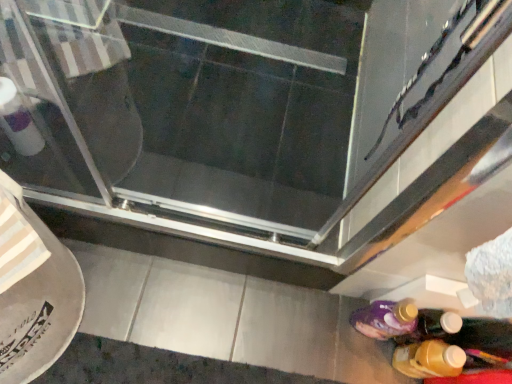
The image size is (512, 384). What do you see at coordinates (196, 103) in the screenshot? I see `transparent glass screen door at center` at bounding box center [196, 103].

I want to click on transparent glass screen door at center, so click(196, 103).

Measure the distance between point (93, 125) and camera.

Point (93, 125) is 1.22 meters from camera.

Where is `translucent plastic bottle at lower right`? The width and height of the screenshot is (512, 384). translucent plastic bottle at lower right is located at coordinates (429, 359).

In order to face translucent plastic bottle at lower right, should I rotate leftwards or rightwards?

To align with it, rotate right about 22.248°.

What do you see at coordinates (429, 359) in the screenshot?
I see `translucent plastic bottle at lower right` at bounding box center [429, 359].

At what (x,y) coordinates should I click in order to perform the action: click on transparent glass screen door at center. Please return your answer as a coordinate pair (x, y). This screenshot has width=512, height=384. Looking at the image, I should click on (196, 103).

Visually, is transparent glass screen door at center positioned to the left or to the right of translucent plastic bottle at lower right?

From the image, it's evident that transparent glass screen door at center is to the left of translucent plastic bottle at lower right.

Who is more distant, transparent glass screen door at center or translucent plastic bottle at lower right?

transparent glass screen door at center is further away from the camera.

Is point (6, 135) farther from camera compared to point (423, 356)?

No.

From the image's perspective, is transparent glass screen door at center above or below translucent plastic bottle at lower right?

Clearly, from the image's perspective, transparent glass screen door at center is above translucent plastic bottle at lower right.

From a real-world perspective, is transparent glass screen door at center above or below translucent plastic bottle at lower right?

From a real-world perspective, transparent glass screen door at center is physically above translucent plastic bottle at lower right.

Is transparent glass screen door at center wider or thinner than translucent plastic bottle at lower right?

Considering their sizes, transparent glass screen door at center looks broader than translucent plastic bottle at lower right.

Considering the relative sizes of transparent glass screen door at center and translucent plastic bottle at lower right in the image provided, is transparent glass screen door at center shorter than translucent plastic bottle at lower right?

Yes.

Based on their sizes in the image, would you say transparent glass screen door at center is bigger or smaller than translucent plastic bottle at lower right?

Clearly, transparent glass screen door at center is larger in size than translucent plastic bottle at lower right.

Is transparent glass screen door at center located outside translucent plastic bottle at lower right?

transparent glass screen door at center lies outside translucent plastic bottle at lower right's area.

Is transparent glass screen door at center touching translucent plastic bottle at lower right?

transparent glass screen door at center is not next to translucent plastic bottle at lower right, and they're not touching.

Is translucent plastic bottle at lower right at the back of transparent glass screen door at center?

transparent glass screen door at center does not have its back to translucent plastic bottle at lower right.

What's the angular difference between transparent glass screen door at center and translucent plastic bottle at lower right's facing directions?

transparent glass screen door at center and translucent plastic bottle at lower right are facing 12.3 degrees away from each other.

Identify the location of screen door above the translucent plastic bottle at lower right (from a real-world perspective). (196, 103).

Can you confirm if translucent plastic bottle at lower right is positioned to the right of transparent glass screen door at center?

Indeed, translucent plastic bottle at lower right is positioned on the right side of transparent glass screen door at center.

Considering the relative positions of translucent plastic bottle at lower right and transparent glass screen door at center in the image provided, is translucent plastic bottle at lower right behind transparent glass screen door at center?

No, translucent plastic bottle at lower right is closer to the viewer.

Which is closer to the camera, [403,369] or [234,95]?

Clearly, point [403,369] is closer to the camera than point [234,95].

From the image's perspective, between translucent plastic bottle at lower right and transparent glass screen door at center, who is located below?

translucent plastic bottle at lower right, from the image's perspective.

From a real-world perspective, is translucent plastic bottle at lower right physically located above or below transparent glass screen door at center?

translucent plastic bottle at lower right is below transparent glass screen door at center.

Which object is thinner, translucent plastic bottle at lower right or transparent glass screen door at center?

With smaller width is translucent plastic bottle at lower right.

Does translucent plastic bottle at lower right have a greater height compared to transparent glass screen door at center?

Indeed, translucent plastic bottle at lower right has a greater height compared to transparent glass screen door at center.

Which of these two, translucent plastic bottle at lower right or transparent glass screen door at center, is smaller?

With smaller size is translucent plastic bottle at lower right.

Would you say translucent plastic bottle at lower right contains transparent glass screen door at center?

No, transparent glass screen door at center is not inside translucent plastic bottle at lower right.

Based on the photo, is translucent plastic bottle at lower right directly adjacent to transparent glass screen door at center?

translucent plastic bottle at lower right and transparent glass screen door at center are not in contact.

Is translucent plastic bottle at lower right facing away from transparent glass screen door at center?

No, translucent plastic bottle at lower right is not facing away from transparent glass screen door at center.

How much distance is there between translucent plastic bottle at lower right and transparent glass screen door at center?

translucent plastic bottle at lower right is 89.76 centimeters away from transparent glass screen door at center.

Find the location of a particular element. The image size is (512, 384). screen door on the left of translucent plastic bottle at lower right is located at coordinates (196, 103).

Locate an element on the screen. bottle to the right of transparent glass screen door at center is located at coordinates (429, 359).

The width and height of the screenshot is (512, 384). I want to click on screen door lying above the translucent plastic bottle at lower right (from the image's perspective), so click(x=196, y=103).